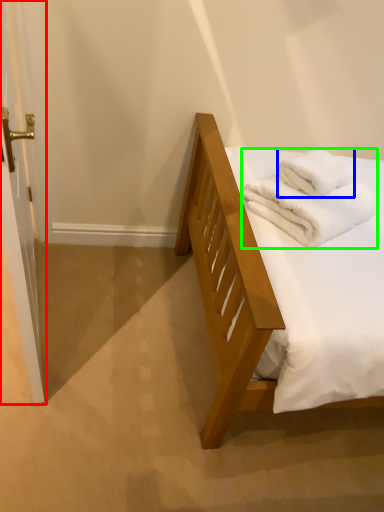
Question: Which object is positioned closest to screen door (highlighted by a red box)? Select from bath towel (highlighted by a blue box) and bath towel (highlighted by a green box).

Choices:
 (A) bath towel
 (B) bath towel

Answer: (B)